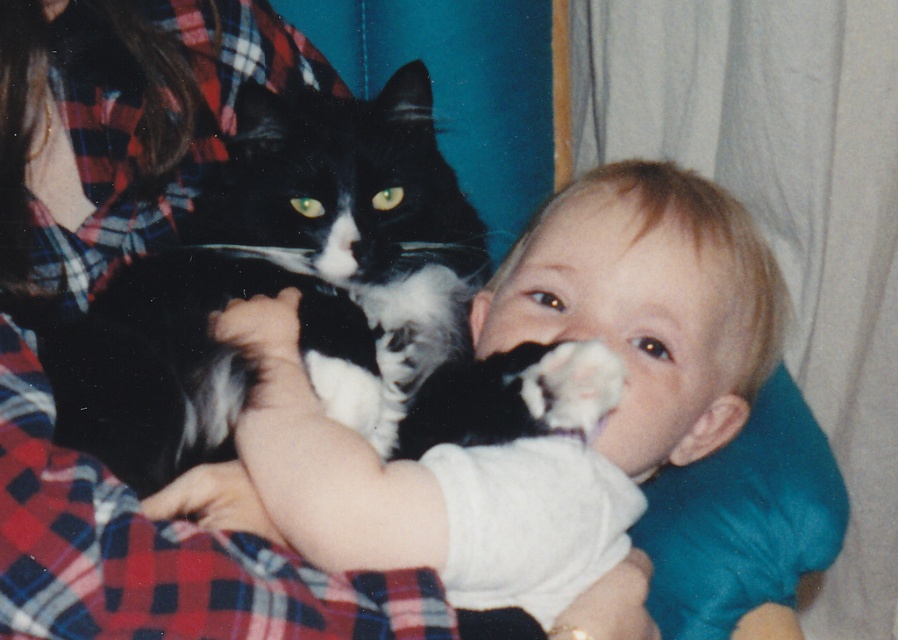
Question: Which of the following is the farthest from the observer?

Choices:
 (A) (401, 141)
 (B) (544, 259)

Answer: (A)

Question: Which of the following is the farthest from the observer?

Choices:
 (A) (82, 358)
 (B) (542, 275)

Answer: (B)

Question: Is black and white fur cat at center closer to the viewer compared to white soft baby at center?

Choices:
 (A) no
 (B) yes

Answer: (A)

Question: Is black and white fur cat at center bigger than white soft baby at center?

Choices:
 (A) no
 (B) yes

Answer: (A)

Question: In this image, where is black and white fur cat at center located relative to white soft baby at center?

Choices:
 (A) left
 (B) right

Answer: (A)